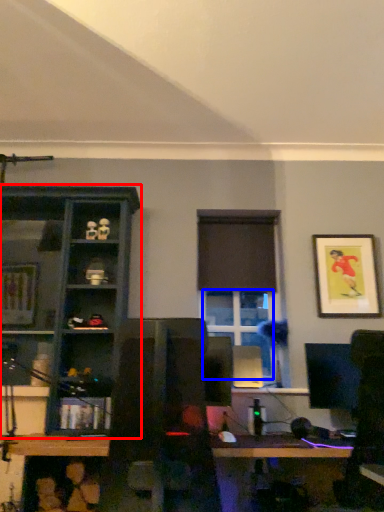
Question: Which object appears closest to the camera in this image, shelf (highlighted by a red box) or window (highlighted by a blue box)?

Choices:
 (A) shelf
 (B) window

Answer: (A)